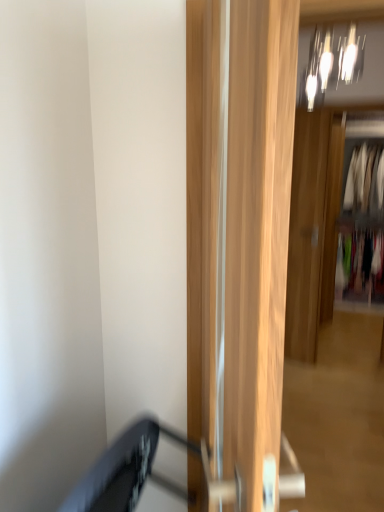
Question: In terms of height, does wooden door at center, arranged as the 2th door when viewed from the front, look taller or shorter compared to multicolored fabric at right, acting as the 3th clothing starting from the top?

Choices:
 (A) short
 (B) tall

Answer: (B)

Question: In terms of width, does wooden door at center, acting as the first door starting from the back, look wider or thinner when compared to multicolored fabric at right, the 1th clothing from the bottom?

Choices:
 (A) wide
 (B) thin

Answer: (B)

Question: Which object is the farthest from the light wood door at center, acting as the 1th door starting from the front?

Choices:
 (A) silky white blouse at upper right, which is the 1th clothing from top to bottom
 (B) metallic glass light fixture at upper center
 (C) white fabric clothes at right, positioned as the 2th clothing in bottom-to-top order
 (D) wooden door at center, which is the second door from left to right
 (E) multicolored fabric at right, the 1th clothing from the bottom

Answer: (A)

Question: Based on their relative distances, which object is nearer to the silky white blouse at upper right, which is the 1th clothing from top to bottom?

Choices:
 (A) wooden door at center, which is the second door from left to right
 (B) white fabric clothes at right, which is the second clothing from top to bottom
 (C) multicolored fabric at right, acting as the 3th clothing starting from the top
 (D) light wood door at center, acting as the 1th door starting from the front
 (E) metallic glass light fixture at upper center

Answer: (B)